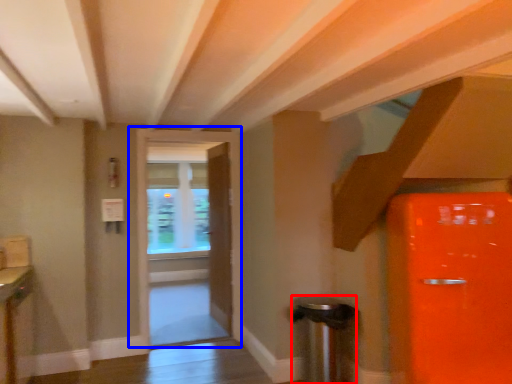
Question: Which of the following is the farthest to the observer, trash bin/can (highlighted by a red box) or door (highlighted by a blue box)?

Choices:
 (A) trash bin/can
 (B) door

Answer: (B)